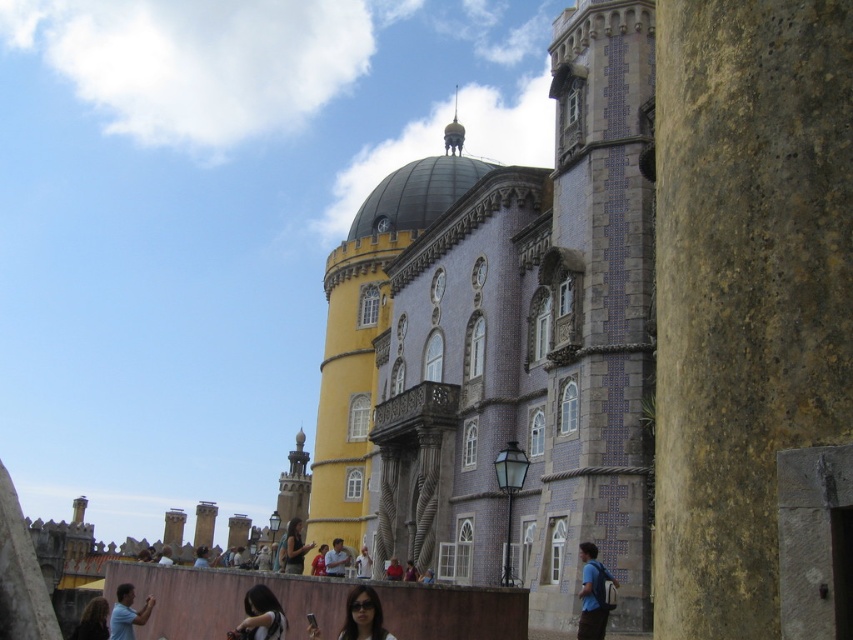
You are a tourist standing in front of the grand building. You notice the yellow painted stone tower at center and the matte black sunglasses at lower center. Which object is taller?

The yellow painted stone tower at center is much taller than the matte black sunglasses at lower center.

You are standing 50 meters away from a grand building with a mix of gray stone and blue tiles. There is a point marked at coordinates point (148, 598). Is this point closer to you or farther than your current position?

The point (148, 598) is 55.69 meters away from the viewer, which is farther than the current 50 meters distance. Therefore, the point is farther away.

You are attending a formal event and see a matte black dress at center and a light brown leather jacket at lower center. Which clothing item is positioned lower on your body?

The matte black dress at center is positioned lower on your body than the light brown leather jacket at lower center.